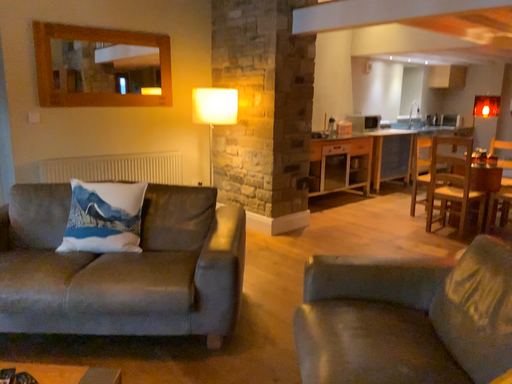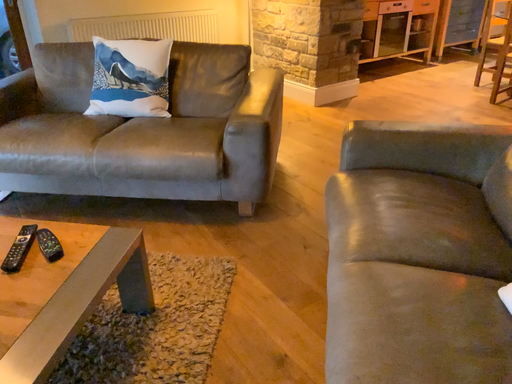
Question: How did the camera likely rotate when shooting the video?

Choices:
 (A) rotated upward
 (B) rotated downward

Answer: (B)